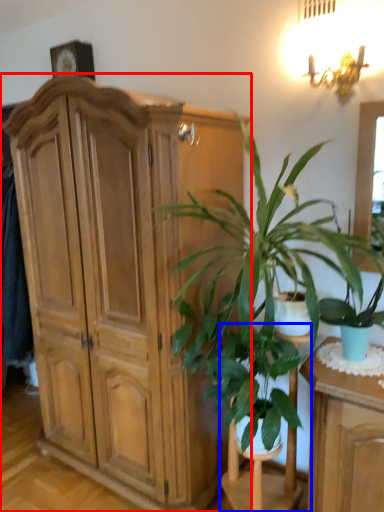
Question: Which of the following is the closest to the observer, cabinetry (highlighted by a red box) or armchair (highlighted by a blue box)?

Choices:
 (A) cabinetry
 (B) armchair

Answer: (B)